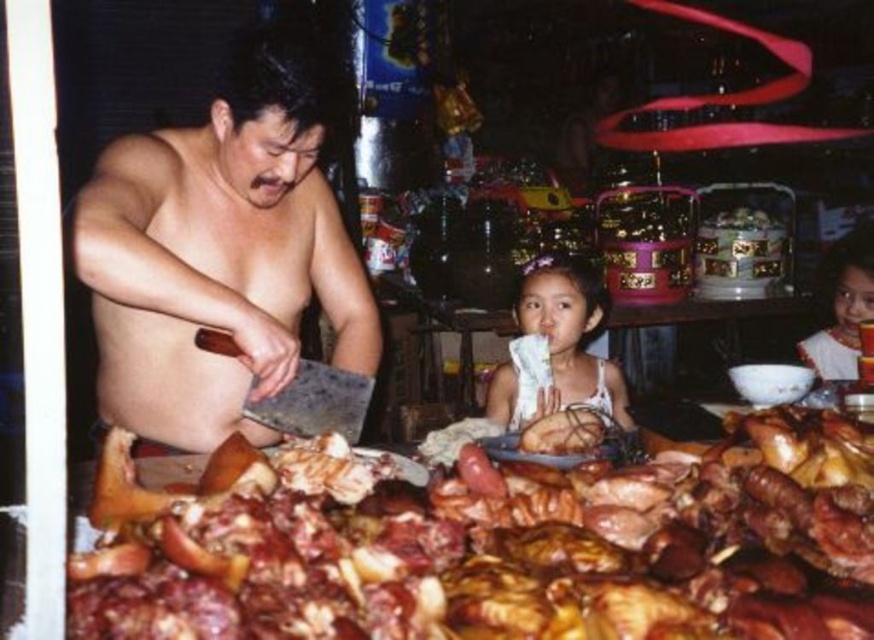
Does shiny metallic cleaver at left come in front of wooden table at center?

Yes, shiny metallic cleaver at left is in front of wooden table at center.

In order to click on shiny metallic cleaver at left in this screenshot , I will do `click(220, 252)`.

Who is shorter, shiny metallic cleaver at left or white lace dress at center?

With less height is white lace dress at center.

Who is higher up, shiny metallic cleaver at left or white lace dress at center?

shiny metallic cleaver at left is above.

Where is `shiny metallic cleaver at left`? This screenshot has height=640, width=874. shiny metallic cleaver at left is located at coordinates (220, 252).

At what (x,y) coordinates should I click in order to perform the action: click on shiny metallic cleaver at left. Please return your answer as a coordinate pair (x, y). This screenshot has width=874, height=640. Looking at the image, I should click on (220, 252).

The height and width of the screenshot is (640, 874). Identify the location of shiny metallic cleaver at left. (220, 252).

Can you confirm if shiny metallic cleaver at left is positioned to the right of matte white dress at center?

In fact, shiny metallic cleaver at left is to the left of matte white dress at center.

The image size is (874, 640). Find the location of `shiny metallic cleaver at left`. shiny metallic cleaver at left is located at coordinates (220, 252).